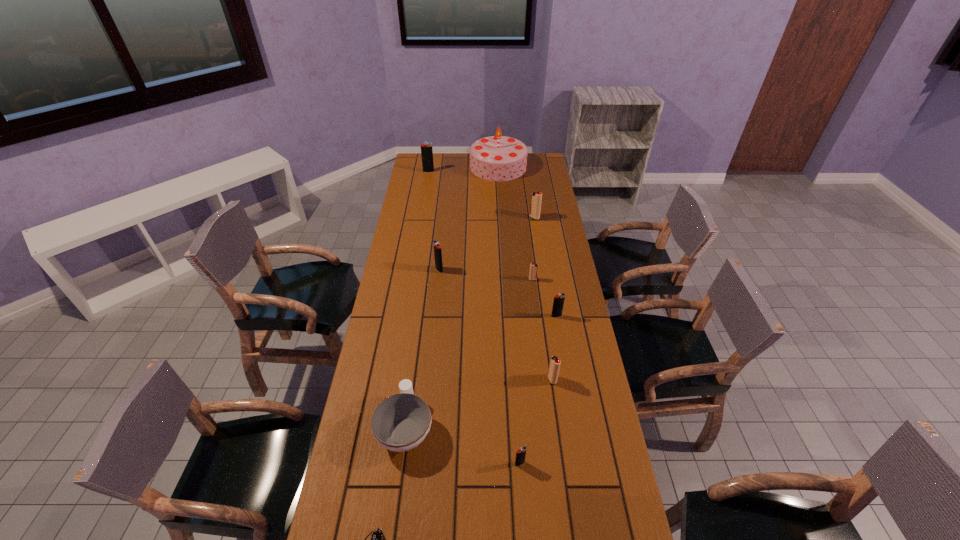
Where is `free spot located on the left of the rightmost black igniter`? The height and width of the screenshot is (540, 960). free spot located on the left of the rightmost black igniter is located at coordinates pos(460,316).

At what (x,y) coordinates should I click in order to perform the action: click on vacant space positioned on the front of the second biggest red igniter. Please return your answer as a coordinate pair (x, y). Looking at the image, I should click on (571, 514).

Find the location of a particular element. vacant space located 0.360m on the side with the handle of the chinaware is located at coordinates (420, 314).

Identify the location of free spot located 0.200m on the side with the handle of the chinaware. The height and width of the screenshot is (540, 960). (416, 347).

Where is `vacant space located 0.240m on the side with the handle of the chinaware`? vacant space located 0.240m on the side with the handle of the chinaware is located at coordinates (418, 338).

The image size is (960, 540). I want to click on vacant space located 0.150m on the right of the sixth nearest object, so click(x=573, y=279).

Identify the location of vacant space located on the back of the nearest black igniter. The width and height of the screenshot is (960, 540). (516, 403).

Find the location of a particular element. Image resolution: width=960 pixels, height=540 pixels. birthday cake present at the far edge is located at coordinates (495, 158).

Identify the location of igniter present at the far edge. (426, 149).

Identify the location of igniter that is at the left edge. (426, 149).